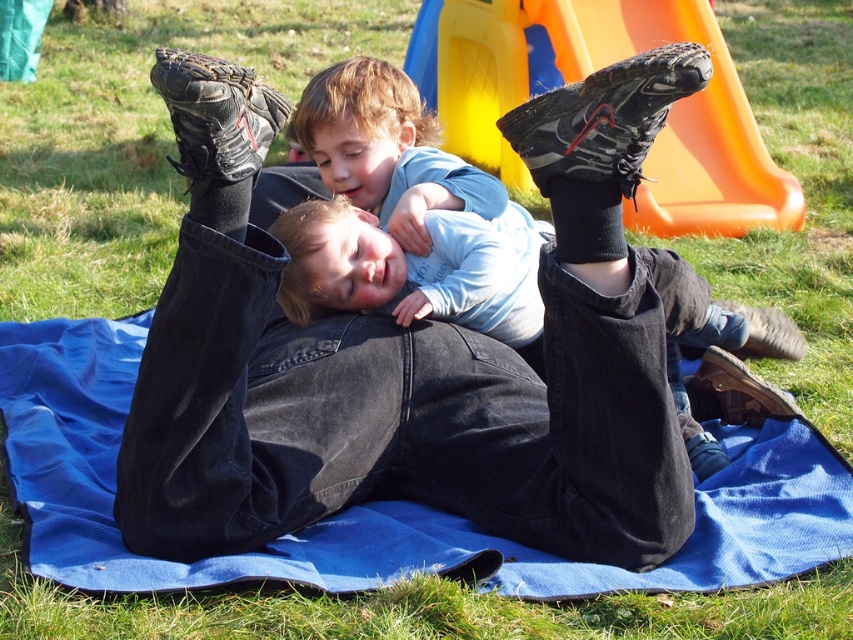
Question: Considering the relative positions of blue fabric blanket at center and orange plastic slide at upper center in the image provided, where is blue fabric blanket at center located with respect to orange plastic slide at upper center?

Choices:
 (A) right
 (B) left

Answer: (B)

Question: Where is blue fabric blanket at center located in relation to orange plastic slide at upper center in the image?

Choices:
 (A) below
 (B) above

Answer: (A)

Question: Which point appears farthest from the camera in this image?

Choices:
 (A) (756, 568)
 (B) (692, 230)

Answer: (B)

Question: Among these points, which one is nearest to the camera?

Choices:
 (A) tap(103, 467)
 (B) tap(492, 28)

Answer: (A)

Question: Is blue fabric blanket at center bigger than orange plastic slide at upper center?

Choices:
 (A) yes
 (B) no

Answer: (B)